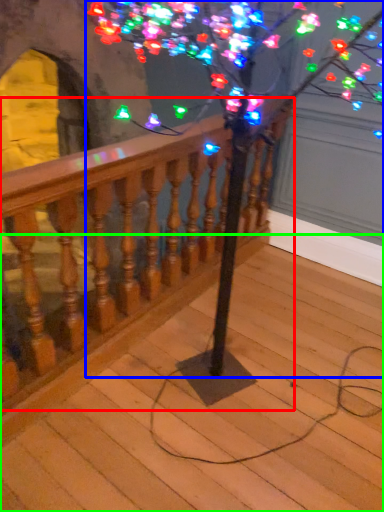
Question: Which object is the closest to the rail (highlighted by a red box)? Choose among these: tree (highlighted by a blue box) or stairs (highlighted by a green box).

Choices:
 (A) tree
 (B) stairs

Answer: (A)